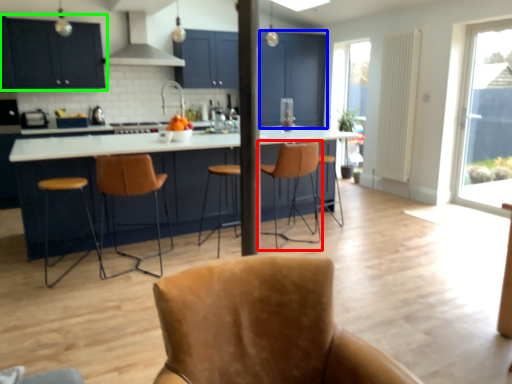
Question: Considering the real-world distances, which object is farthest from chair (highlighted by a red box)? screen door (highlighted by a blue box) or cabinetry (highlighted by a green box)?

Choices:
 (A) screen door
 (B) cabinetry

Answer: (A)